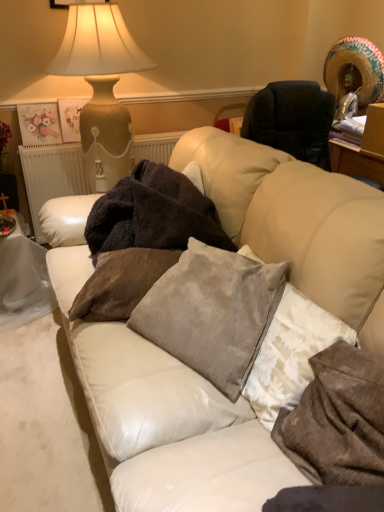
Question: Is point click(x=243, y=300) positioned closer to the camera than point click(x=185, y=231)?

Choices:
 (A) closer
 (B) farther

Answer: (A)

Question: Is velvet gray pillow at center, marked as the 2th pillow in a left-to-right arrangement, inside or outside of dark brown plush blanket at center?

Choices:
 (A) outside
 (B) inside

Answer: (A)

Question: Based on their relative distances, which object is farther from the velvet gray pillow at center, marked as the 2th pillow in a left-to-right arrangement?

Choices:
 (A) wooden picture frame at upper center
 (B) dark brown plush blanket at center
 (C) matte beige ceramic table lamp at upper left
 (D) white textured pillow at lower right, the first pillow positioned from the right
 (E) velvet brown pillow at center, the first pillow positioned from the left

Answer: (A)

Question: Estimate the real-world distances between objects in this image. Which object is farther from the matte beige ceramic table lamp at upper left?

Choices:
 (A) velvet brown pillow at center, the third pillow from the right
 (B) white textured pillow at lower right, the first pillow positioned from the right
 (C) wooden picture frame at upper center
 (D) dark brown plush blanket at center
 (E) velvet gray pillow at center, marked as the 2th pillow in a left-to-right arrangement

Answer: (B)